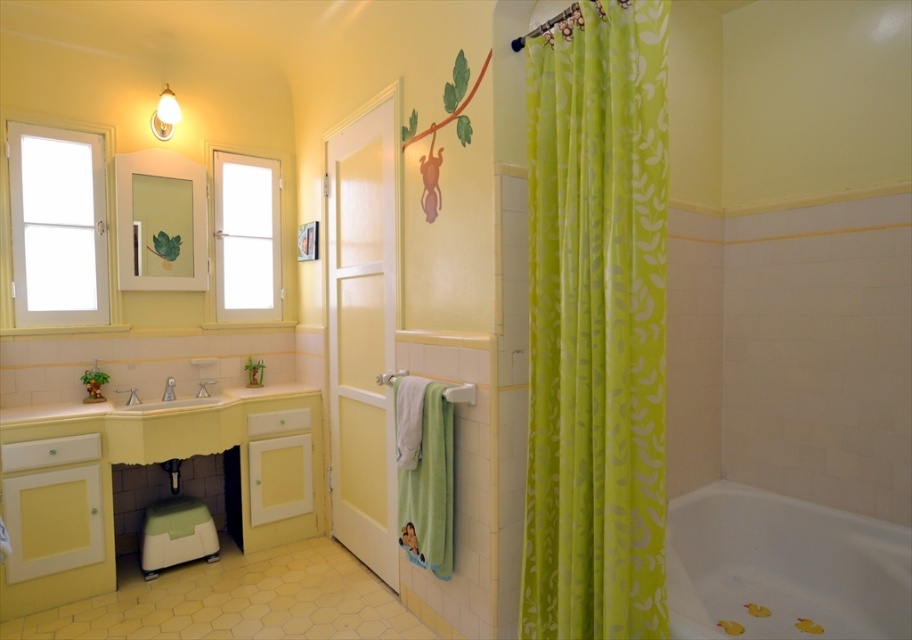
You are arranging a bathroom shelf and need to place the lime green fabric at right and the brushed metal faucet at sink left. According to the scene, which object is positioned to the right side?

The lime green fabric at right is positioned to the right of the brushed metal faucet at sink left, so the lime green fabric at right is on the right side.

You are a person with a height of 1.6 meters. You are standing in the bathroom and want to reach the lime green fabric at right. Can you touch it without moving your feet?

The lime green fabric at right and viewer are 1.59 meters apart from each other. Since the viewer is 1.6 meters tall, they can reach it by stretching their arm upwards as the distance matches their height.